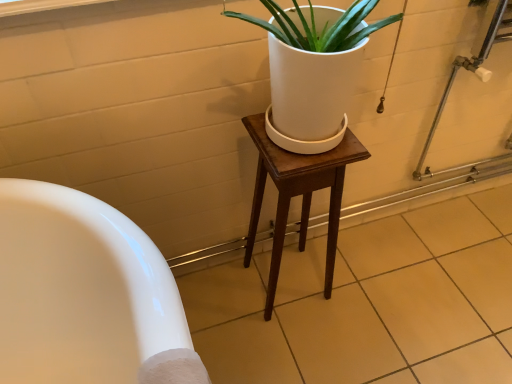
The image size is (512, 384). Identify the location of vacant region to the left of wooden stool at center. (223, 309).